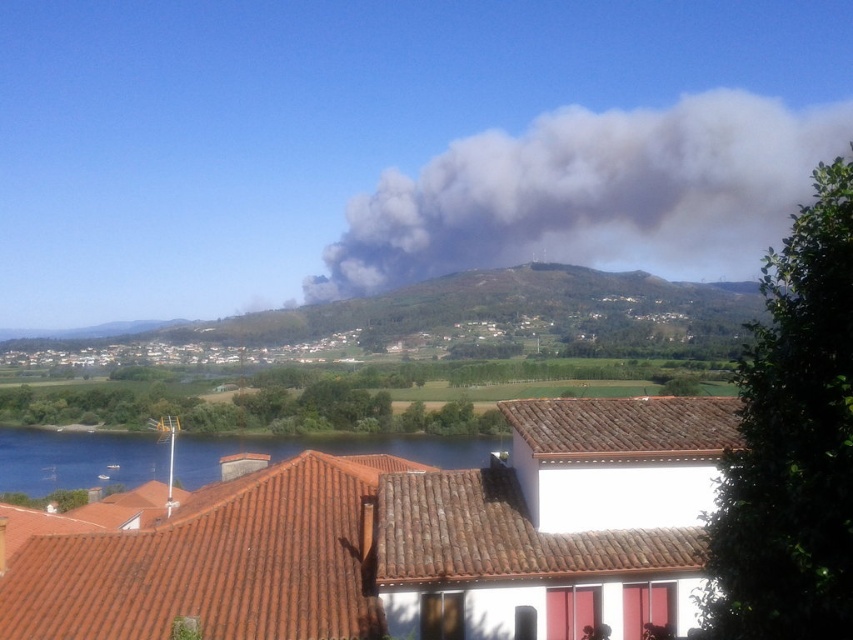
You are a photographer planning to capture the entire scene. You notice the gray smoke at upper center and the blue water at lower left. Which object should you adjust your camera focus to ensure the other remains in the background?

You should focus on the gray smoke at upper center because the blue water at lower left is behind it, so keeping the smoke in focus will naturally place the water in the background.

You are a pilot flying over the rural landscape described. You notice the gray smoke at upper center and the blue water at lower left. Which object is positioned to the right when comparing their locations?

The gray smoke at upper center is to the right of the blue water at lower left.